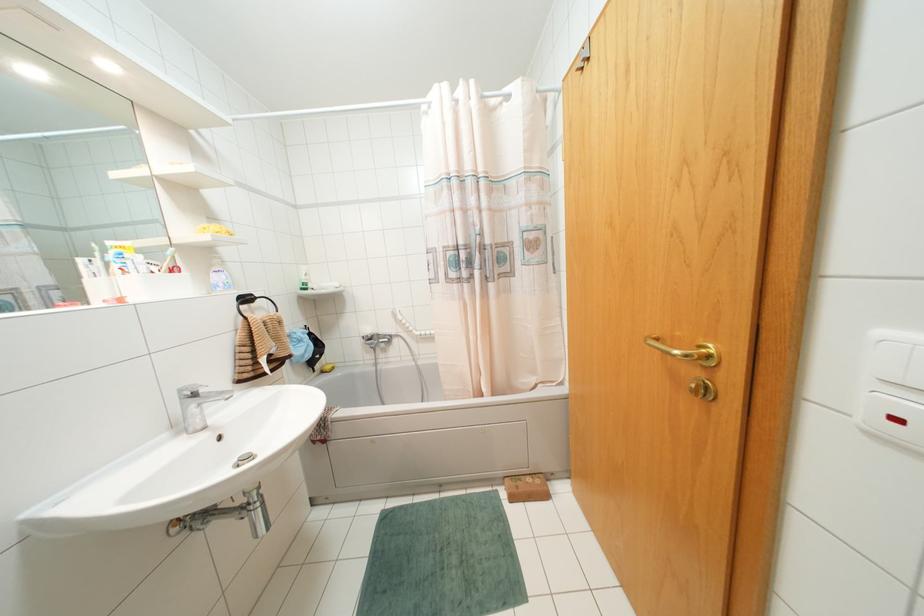
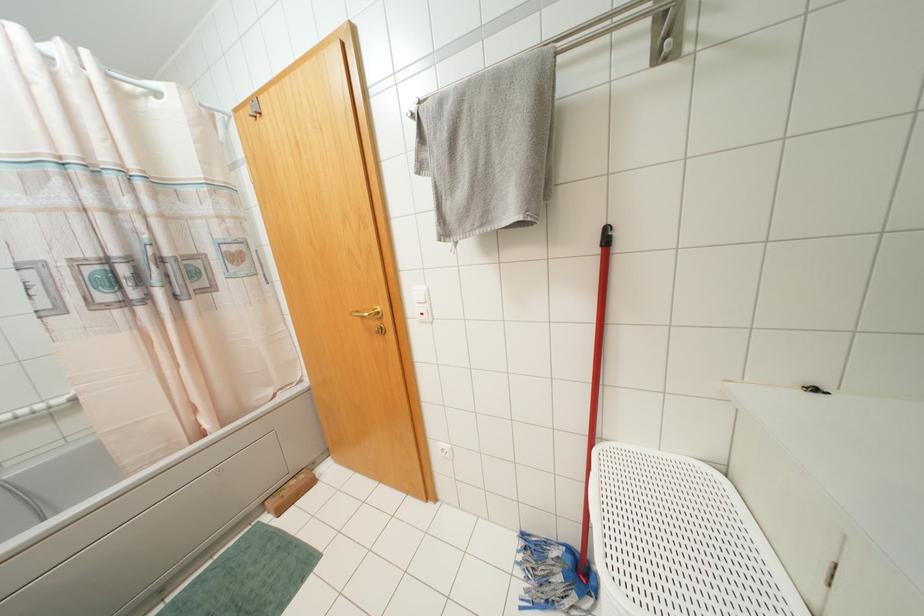
In the second image, find the point that corresponds to pixel 709 355 in the first image.

(378, 312)